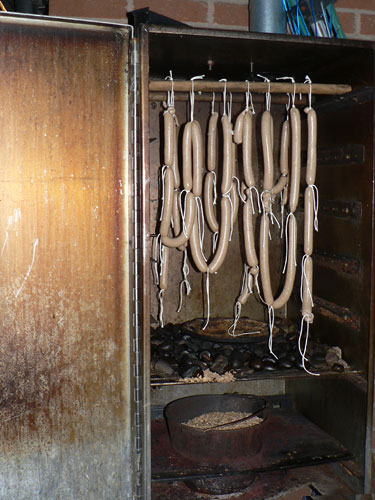
Find the location of a particular element. This screenshot has width=375, height=500. pot handle is located at coordinates (231, 419).